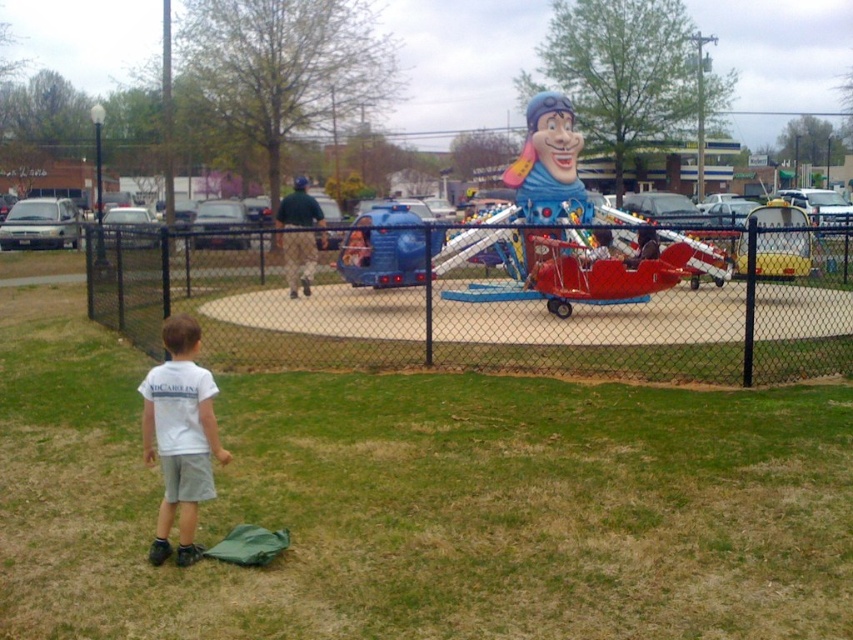
The user is a parent trying to decide whether to let their child approach the red plastic airplane at center. The child is wearing the white cotton shirt at lower left. The parent is concerned about the distance between the shirt and the airplane. Can you determine if the shirt is closer to the airplane than the parent is?

The objects description states that the red plastic airplane at center might be wider than white cotton shirt at lower left, but it does not provide information about their distances from the parent. Therefore, I cannot determine if the shirt is closer to the airplane than the parent is based on the given information.